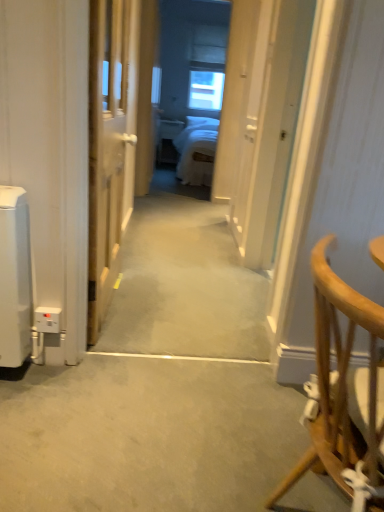
Question: Is transparent glass window at center taller or shorter than wooden door at center?

Choices:
 (A) tall
 (B) short

Answer: (B)

Question: Would you say transparent glass window at center is inside or outside wooden door at center?

Choices:
 (A) outside
 (B) inside

Answer: (A)

Question: Which object is positioned farthest from the light brown wooden chair at right?

Choices:
 (A) carpeted hallway at center, the 1th path when ordered from top to bottom
 (B) gray carpet at center, acting as the first path starting from the bottom
 (C) wooden door at center
 (D) transparent glass window at center

Answer: (D)

Question: Based on their relative distances, which object is nearer to the gray carpet at center, which ranks as the 1th path in front-to-back order?

Choices:
 (A) transparent glass window at center
 (B) wooden door at center
 (C) carpeted hallway at center, the 2th path positioned from the bottom
 (D) light brown wooden chair at right

Answer: (C)